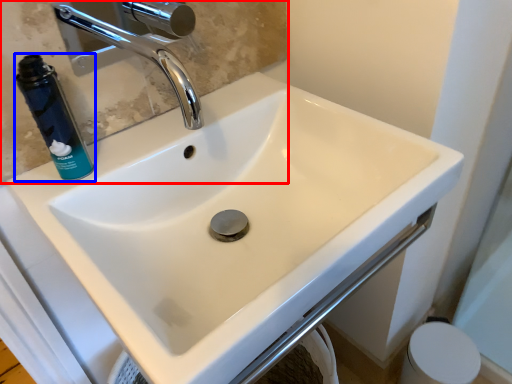
Question: Among these objects, which one is nearest to the camera, mirror (highlighted by a red box) or mouthwash (highlighted by a blue box)?

Choices:
 (A) mirror
 (B) mouthwash

Answer: (A)